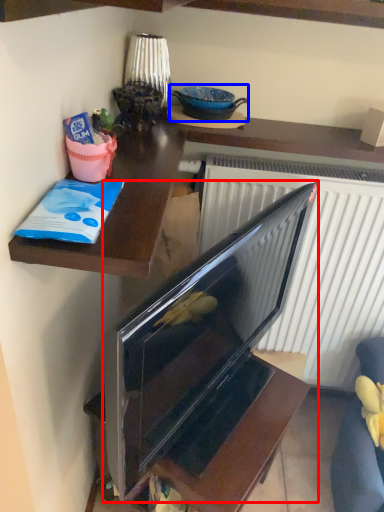
Question: Which object is further to the camera taking this photo, television (highlighted by a red box) or appliance (highlighted by a blue box)?

Choices:
 (A) television
 (B) appliance

Answer: (B)